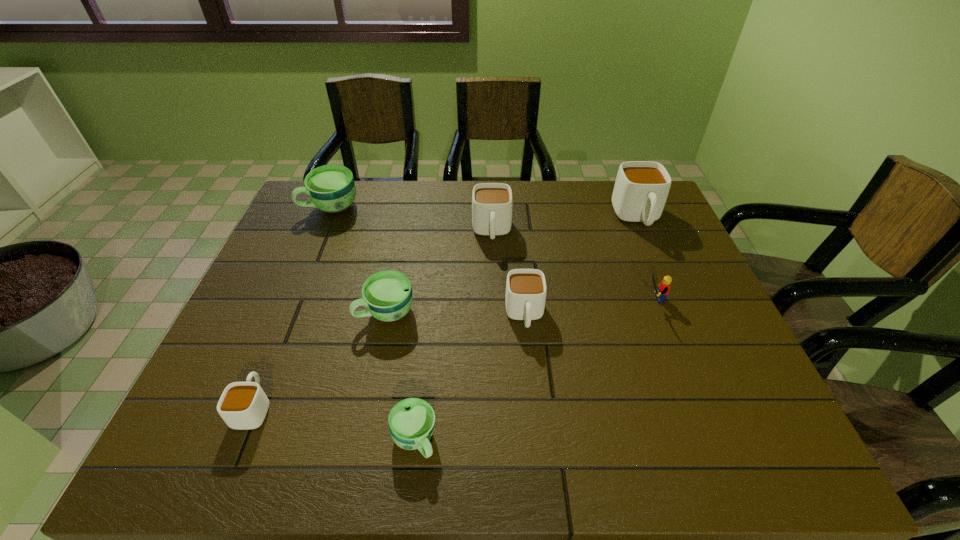
What are the coordinates of `blue cup identified as the second closest to the second nearest white cup` in the screenshot? It's located at (411, 421).

Locate an element on the screen. vacant position in the image that satisfies the following two spatial constraints: 1. on the front-facing side of the yellow Lego; 2. on the side with the handle of the second nearest white cup is located at coordinates (658, 315).